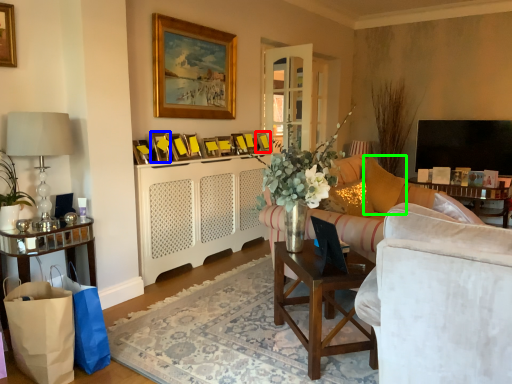
Question: Which is farther away from picture frame (highlighted by a red box)? picture frame (highlighted by a blue box) or pillow (highlighted by a green box)?

Choices:
 (A) picture frame
 (B) pillow

Answer: (A)